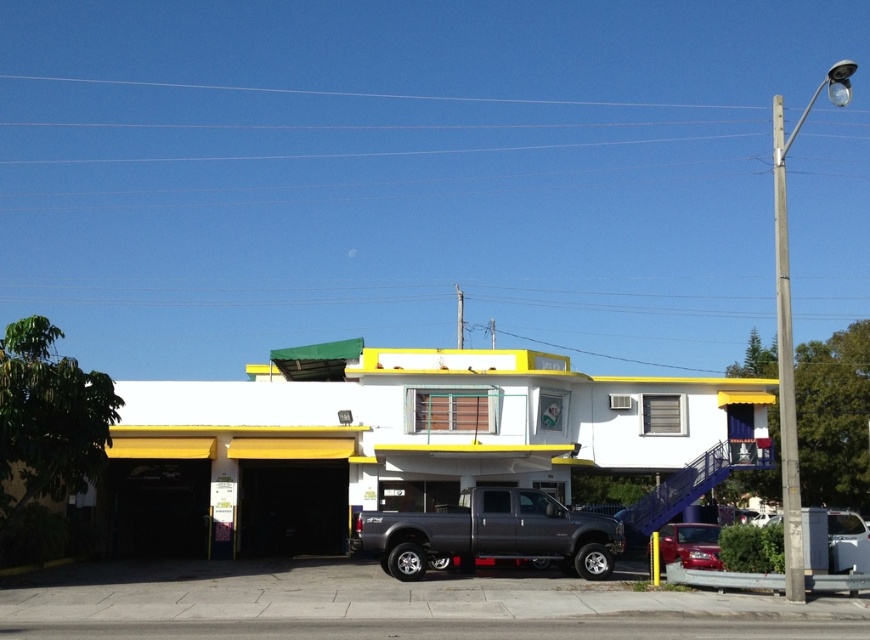
You are standing in front of the two story retro building and want to walk towards the entrance. There are two points marked on the truck, point [600,564] and point [691,550]. Which point would you have to walk around first to reach the entrance?

Point [600,564] is closer to the viewer than point [691,550], so you would have to walk around point [600,564] first to reach the entrance.